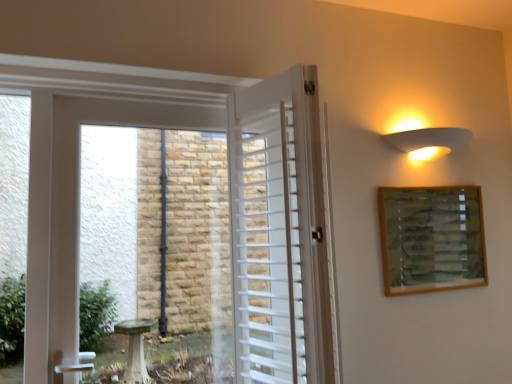
Question: From the image's perspective, is white matte wall sconce at upper right positioned above or below white wooden door at center?

Choices:
 (A) above
 (B) below

Answer: (A)

Question: Relative to white wooden door at center, is white matte wall sconce at upper right in front or behind?

Choices:
 (A) front
 (B) behind

Answer: (B)

Question: Considering the real-world distances, which object is closest to the white matte wall sconce at upper right?

Choices:
 (A) wooden picture frame at upper right
 (B) white wooden door at center

Answer: (A)

Question: Estimate the real-world distances between objects in this image. Which object is closer to the white wooden door at center?

Choices:
 (A) wooden picture frame at upper right
 (B) white matte wall sconce at upper right

Answer: (A)